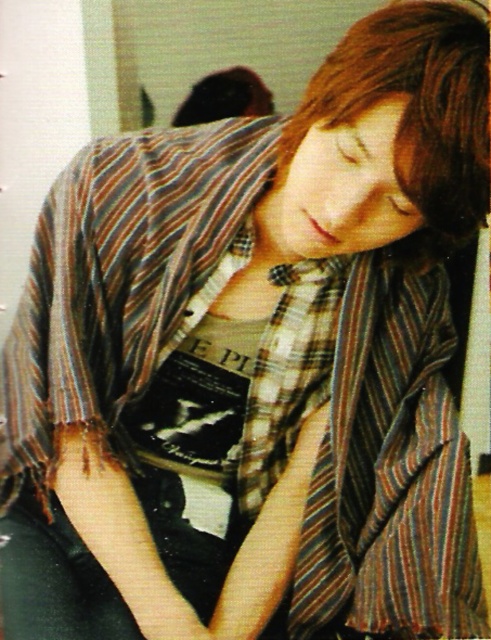
Question: Which point is farther to the camera?

Choices:
 (A) brown smooth hair at upper center
 (B) shiny brown hair at upper center

Answer: (B)

Question: Is brown smooth hair at upper center above shiny brown hair at upper center?

Choices:
 (A) no
 (B) yes

Answer: (A)

Question: Which point appears farthest from the camera in this image?

Choices:
 (A) (228, 100)
 (B) (443, 68)

Answer: (A)

Question: Observing the image, what is the correct spatial positioning of brown smooth hair at upper center in reference to shiny brown hair at upper center?

Choices:
 (A) above
 (B) below

Answer: (B)

Question: Is brown smooth hair at upper center wider than shiny brown hair at upper center?

Choices:
 (A) yes
 (B) no

Answer: (B)

Question: Which of the following is the farthest from the observer?

Choices:
 (A) brown smooth hair at upper center
 (B) shiny brown hair at upper center

Answer: (B)